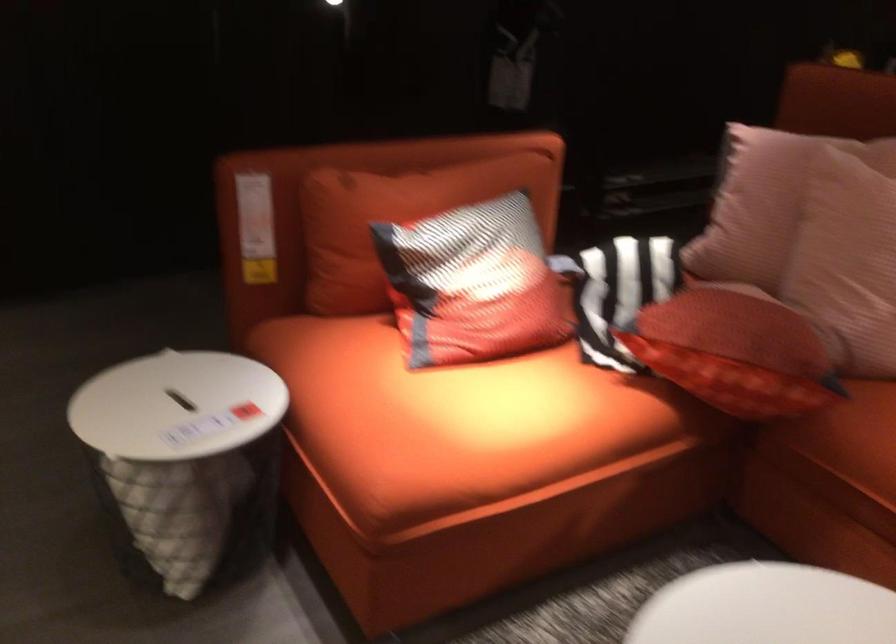
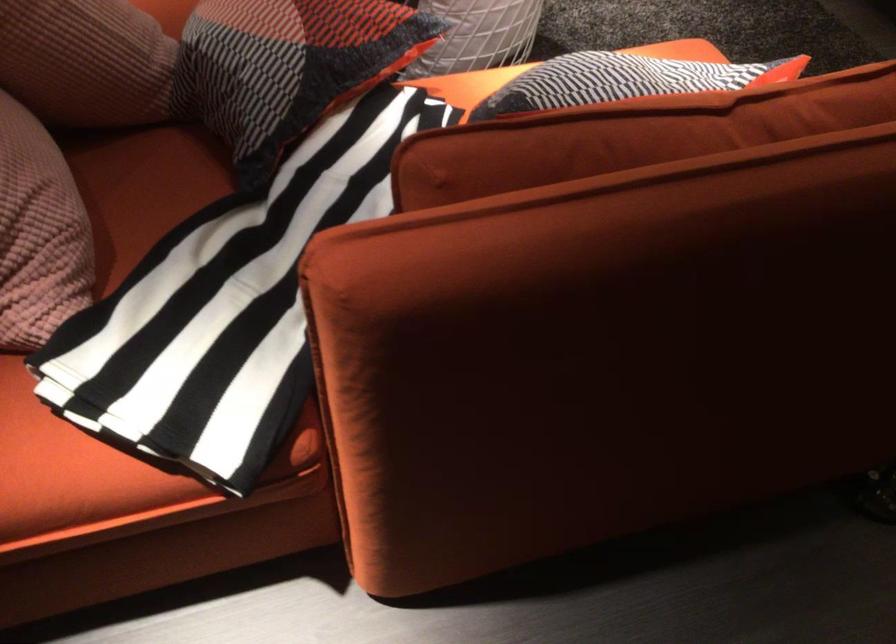
Find the pixel in the second image that matches (466,207) in the first image.

(623, 80)